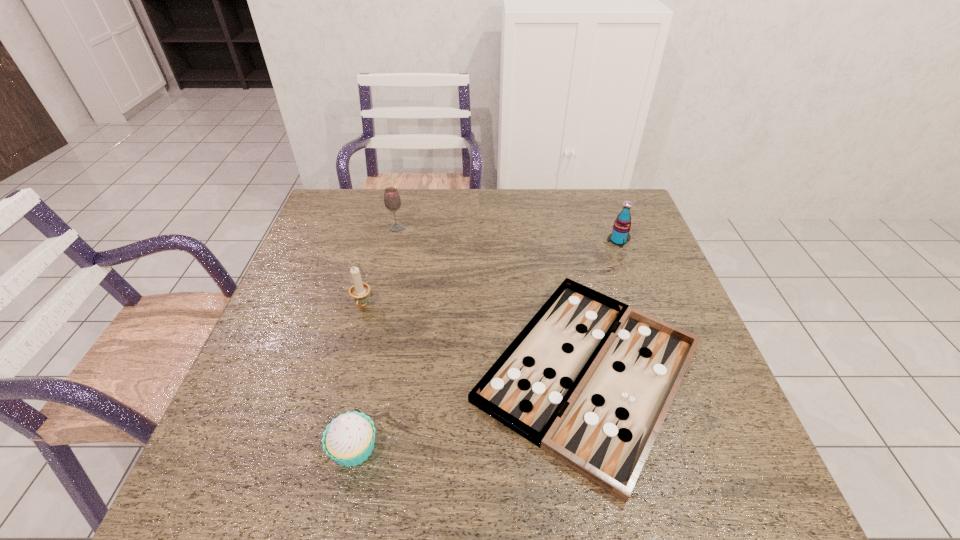
Where is `free space at the far left corner`? This screenshot has height=540, width=960. free space at the far left corner is located at coordinates (328, 208).

You are a GUI agent. You are given a task and a screenshot of the screen. Output one action in this format:
    pyautogui.click(x=<x>, y=<y>)
    Task: Click on the vacant space at the near left corner
    The width and height of the screenshot is (960, 540).
    Given the screenshot: What is the action you would take?
    pyautogui.click(x=230, y=465)

Where is `blank area at the far right corner`? This screenshot has height=540, width=960. blank area at the far right corner is located at coordinates (598, 191).

Where is `unoccupied position between the glass drink container and the candle_holder`? unoccupied position between the glass drink container and the candle_holder is located at coordinates (379, 267).

The image size is (960, 540). What are the coordinates of `free spot between the glass drink container and the fourth nearest object` in the screenshot? It's located at (508, 234).

Identify the location of vacant area that lies between the candle_holder and the farthest object. Image resolution: width=960 pixels, height=540 pixels. (379, 267).

Find the location of a particular element. Image resolution: width=960 pixels, height=540 pixels. vacant space that is in between the glass drink container and the second shortest object is located at coordinates (375, 338).

I want to click on free point between the candle_holder and the gameboard, so click(476, 339).

You are a GUI agent. You are given a task and a screenshot of the screen. Output one action in this format:
    pyautogui.click(x=<x>, y=<y>)
    Task: Click on the free space between the fourth tallest object and the glass drink container
    The image size is (960, 540).
    Given the screenshot: What is the action you would take?
    pyautogui.click(x=375, y=338)

Locate an element on the screen. The height and width of the screenshot is (540, 960). free space between the candle_holder and the soda is located at coordinates (491, 273).